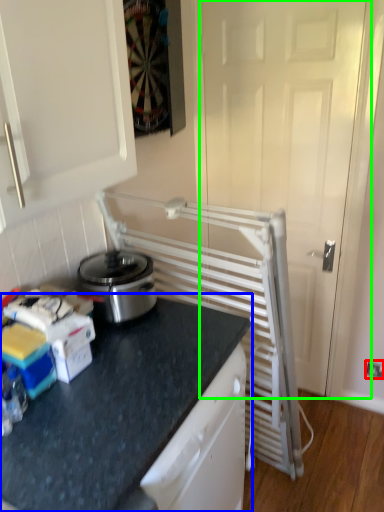
Question: Which is farther away from electric outlet (highlighted by a red box)? countertop (highlighted by a blue box) or screen door (highlighted by a green box)?

Choices:
 (A) countertop
 (B) screen door

Answer: (A)